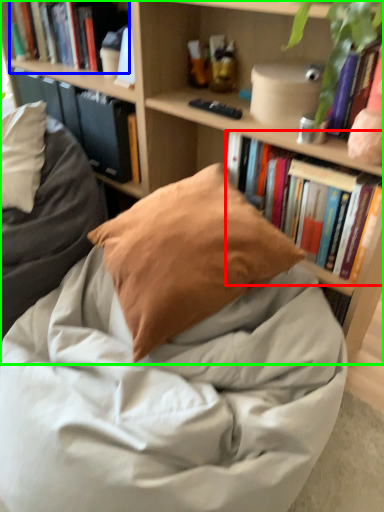
Question: Which object is positioned closest to book (highlighted by a red box)? Select from book (highlighted by a blue box) and bookcase (highlighted by a green box).

Choices:
 (A) book
 (B) bookcase

Answer: (B)